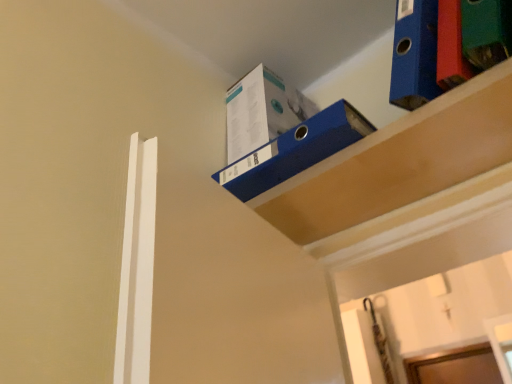
In order to face blue cardboard box at upper right, the first shelf viewed from the right, should I rotate leftwards or rightwards?

You should rotate right by 15.610 degrees.

Describe the element at coordinates (262, 111) in the screenshot. I see `blue cardboard box at upper center` at that location.

Where is `blue cardboard box at upper right, the first shelf viewed from the right`? The image size is (512, 384). blue cardboard box at upper right, the first shelf viewed from the right is located at coordinates (399, 162).

From a real-world perspective, is blue cardboard box at upper right, the 2th shelf from the left, under blue cardboard box at upper center, marked as the first shelf in a left-to-right arrangement?

Indeed, from a real-world perspective, blue cardboard box at upper right, the 2th shelf from the left, is positioned beneath blue cardboard box at upper center, marked as the first shelf in a left-to-right arrangement.

Is blue cardboard box at upper right, the 2th shelf from the left, in front of or behind blue cardboard box at upper center, marked as the first shelf in a left-to-right arrangement, in the image?

blue cardboard box at upper right, the 2th shelf from the left, is in front of blue cardboard box at upper center, marked as the first shelf in a left-to-right arrangement.

Could you measure the distance between blue cardboard box at upper right, the 2th shelf from the left, and blue cardboard box at upper center, which ranks as the second shelf in right-to-left order?

blue cardboard box at upper right, the 2th shelf from the left, and blue cardboard box at upper center, which ranks as the second shelf in right-to-left order, are 4.13 inches apart from each other.

Is point (442, 135) farther from camera compared to point (329, 131)?

No, (442, 135) is closer to viewer.

Considering the positions of objects blue cardboard box at upper right, the 2th shelf from the left, and blue cardboard box at upper center in the image provided, who is in front, blue cardboard box at upper right, the 2th shelf from the left, or blue cardboard box at upper center?

blue cardboard box at upper right, the 2th shelf from the left, is in front.

Considering the relative positions of blue cardboard box at upper right, the first shelf viewed from the right, and blue cardboard box at upper center in the image provided, is blue cardboard box at upper right, the first shelf viewed from the right, to the left of blue cardboard box at upper center from the viewer's perspective?

No.

Which is more distant, (435, 160) or (236, 120)?

Point (236, 120)

Is blue cardboard box at upper right, the first shelf viewed from the right, oriented towards blue cardboard box at upper center?

No, blue cardboard box at upper right, the first shelf viewed from the right, does not turn towards blue cardboard box at upper center.

Is blue cardboard box at upper center, which ranks as the second shelf in right-to-left order, thinner than blue cardboard box at upper right, the first shelf viewed from the right?

No.

Is point (345, 137) less distant than point (411, 181)?

Yes.

From the image's perspective, is blue cardboard box at upper center, marked as the first shelf in a left-to-right arrangement, under blue cardboard box at upper right, the first shelf viewed from the right?

Actually, blue cardboard box at upper center, marked as the first shelf in a left-to-right arrangement, appears above blue cardboard box at upper right, the first shelf viewed from the right, in the image.

How different are the orientations of blue cardboard box at upper center and blue cardboard box at upper right, the first shelf viewed from the right, in degrees?

The angle between the facing direction of blue cardboard box at upper center and the facing direction of blue cardboard box at upper right, the first shelf viewed from the right, is 2.24 degrees.

Does blue cardboard box at upper center have a lesser width compared to blue cardboard box at upper right, the first shelf viewed from the right?

No.

Do you think blue cardboard box at upper center is within blue cardboard box at upper right, the first shelf viewed from the right, or outside of it?

blue cardboard box at upper center cannot be found inside blue cardboard box at upper right, the first shelf viewed from the right.

Is blue cardboard box at upper center, marked as the first shelf in a left-to-right arrangement, in contact with blue cardboard box at upper center?

No, blue cardboard box at upper center, marked as the first shelf in a left-to-right arrangement, is not next to blue cardboard box at upper center.

From the image's perspective, between blue cardboard box at upper center, which ranks as the second shelf in right-to-left order, and blue cardboard box at upper center, who is located below?

blue cardboard box at upper center, which ranks as the second shelf in right-to-left order.

Between blue cardboard box at upper center, marked as the first shelf in a left-to-right arrangement, and blue cardboard box at upper center, which one has smaller size?

blue cardboard box at upper center, marked as the first shelf in a left-to-right arrangement, is smaller.

From a real-world perspective, is blue cardboard box at upper center physically below blue cardboard box at upper center, which ranks as the second shelf in right-to-left order?

Actually, blue cardboard box at upper center is physically above blue cardboard box at upper center, which ranks as the second shelf in right-to-left order, in the real world.

Considering their positions, is blue cardboard box at upper center located in front of or behind blue cardboard box at upper center, marked as the first shelf in a left-to-right arrangement?

blue cardboard box at upper center is behind blue cardboard box at upper center, marked as the first shelf in a left-to-right arrangement.

The height and width of the screenshot is (384, 512). I want to click on box on the left of blue cardboard box at upper center, marked as the first shelf in a left-to-right arrangement, so click(262, 111).

Would you say blue cardboard box at upper center, which ranks as the second shelf in right-to-left order, is part of blue cardboard box at upper center's contents?

No, blue cardboard box at upper center, which ranks as the second shelf in right-to-left order, is not surrounded by blue cardboard box at upper center.

Find the location of a particular element. Image resolution: width=512 pixels, height=384 pixels. shelf lying on the left of blue cardboard box at upper right, the first shelf viewed from the right is located at coordinates (294, 151).

Locate an element on the screen. This screenshot has width=512, height=384. box located above the blue cardboard box at upper right, the 2th shelf from the left (from a real-world perspective) is located at coordinates (262, 111).

From the image, which object appears to be farther from blue cardboard box at upper right, the 2th shelf from the left, blue cardboard box at upper center or blue cardboard box at upper center, which ranks as the second shelf in right-to-left order?

Based on the image, blue cardboard box at upper center appears to be further to blue cardboard box at upper right, the 2th shelf from the left.

From the image, which object appears to be farther from blue cardboard box at upper right, the first shelf viewed from the right, blue cardboard box at upper center, marked as the first shelf in a left-to-right arrangement, or blue cardboard box at upper center?

blue cardboard box at upper center lies further to blue cardboard box at upper right, the first shelf viewed from the right, than the other object.

From the image, which object appears to be nearer to blue cardboard box at upper center, which ranks as the second shelf in right-to-left order, blue cardboard box at upper center or blue cardboard box at upper right, the 2th shelf from the left?

The object closer to blue cardboard box at upper center, which ranks as the second shelf in right-to-left order, is blue cardboard box at upper right, the 2th shelf from the left.

Estimate the real-world distances between objects in this image. Which object is further from blue cardboard box at upper center, blue cardboard box at upper center, which ranks as the second shelf in right-to-left order, or blue cardboard box at upper right, the first shelf viewed from the right?

blue cardboard box at upper right, the first shelf viewed from the right.

Based on their spatial positions, is blue cardboard box at upper right, the first shelf viewed from the right, or blue cardboard box at upper center, marked as the first shelf in a left-to-right arrangement, further from blue cardboard box at upper center?

The object further to blue cardboard box at upper center is blue cardboard box at upper right, the first shelf viewed from the right.

From the image, which object appears to be nearer to blue cardboard box at upper center, marked as the first shelf in a left-to-right arrangement, blue cardboard box at upper right, the first shelf viewed from the right, or blue cardboard box at upper center?

blue cardboard box at upper right, the first shelf viewed from the right, lies closer to blue cardboard box at upper center, marked as the first shelf in a left-to-right arrangement, than the other object.

Identify the location of shelf between blue cardboard box at upper right, the 2th shelf from the left, and blue cardboard box at upper center from front to back. (294, 151).